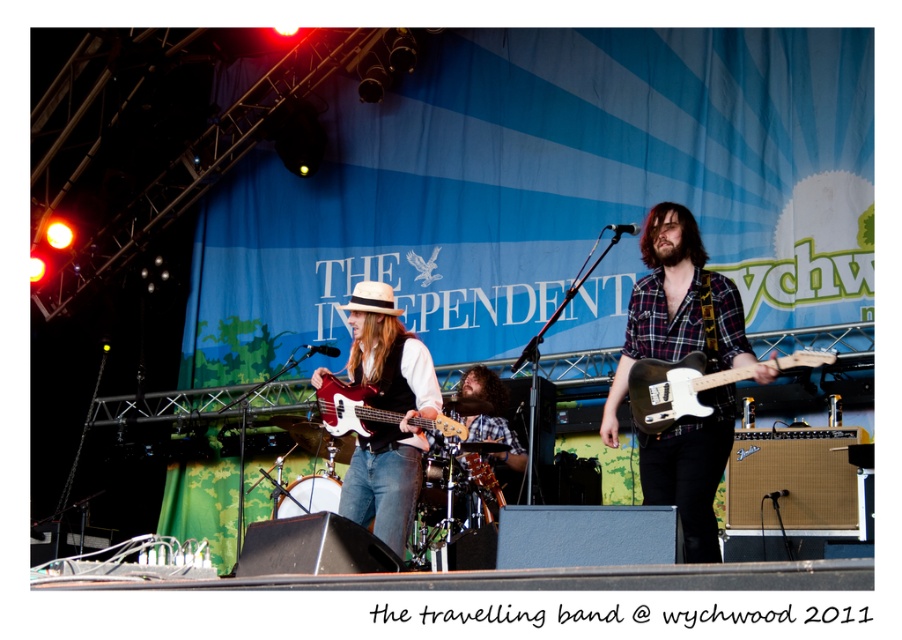
Question: Can you confirm if matte black bass guitar at center is bigger than matte red electric guitar at center?

Choices:
 (A) no
 (B) yes

Answer: (B)

Question: Based on their relative distances, which object is nearer to the glossy wood guitar at center?

Choices:
 (A) matte black bass guitar at center
 (B) black matte electric guitar at center
 (C) plaid fabric guitar at center

Answer: (A)

Question: Which point is farther to the camera?

Choices:
 (A) (319, 396)
 (B) (403, 525)

Answer: (A)

Question: Which of the following is the closest to the observer?

Choices:
 (A) matte black bass guitar at center
 (B) matte red electric guitar at center
 (C) plaid fabric guitar at center
 (D) glossy wood guitar at center

Answer: (A)

Question: Is black matte electric guitar at center above matte red electric guitar at center?

Choices:
 (A) no
 (B) yes

Answer: (B)

Question: Does plaid fabric guitar at center appear on the right side of matte red electric guitar at center?

Choices:
 (A) no
 (B) yes

Answer: (B)